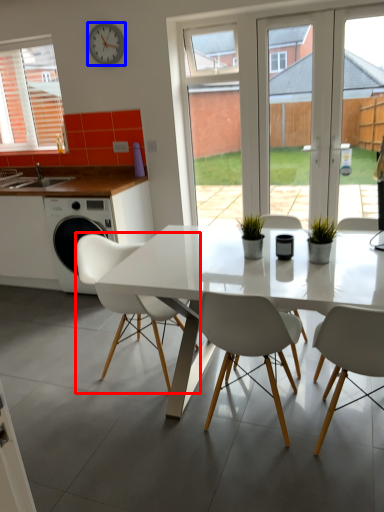
Question: Which of the following is the farthest to the observer, chair (highlighted by a red box) or clock (highlighted by a blue box)?

Choices:
 (A) chair
 (B) clock

Answer: (B)